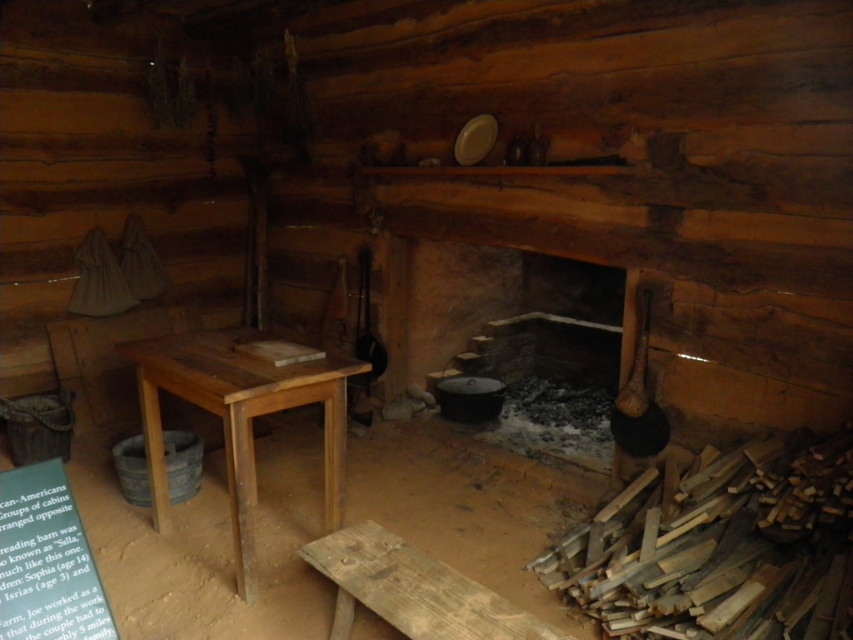
Question: Can you confirm if dark brown stone fireplace at center is wider than weathered wooden bench at lower center?

Choices:
 (A) yes
 (B) no

Answer: (A)

Question: Can you confirm if dark brown stone fireplace at center is positioned to the left of weathered wooden bench at lower center?

Choices:
 (A) no
 (B) yes

Answer: (A)

Question: Which object is farther from the camera taking this photo?

Choices:
 (A) dark brown stone fireplace at center
 (B) wooden table at center

Answer: (A)

Question: Does wooden table at center have a lesser width compared to weathered wooden bench at lower center?

Choices:
 (A) yes
 (B) no

Answer: (B)

Question: Which point is farther to the camera?

Choices:
 (A) weathered wooden bench at lower center
 (B) wooden table at center
 (C) dark brown stone fireplace at center

Answer: (C)

Question: Which object is closer to the camera taking this photo?

Choices:
 (A) wooden table at center
 (B) dark brown stone fireplace at center

Answer: (A)